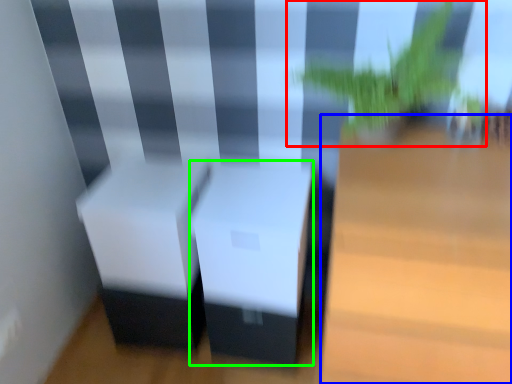
Question: Which is nearer to the houseplant (highlighted by a red box)? table (highlighted by a blue box) or table (highlighted by a green box).

Choices:
 (A) table
 (B) table

Answer: (A)